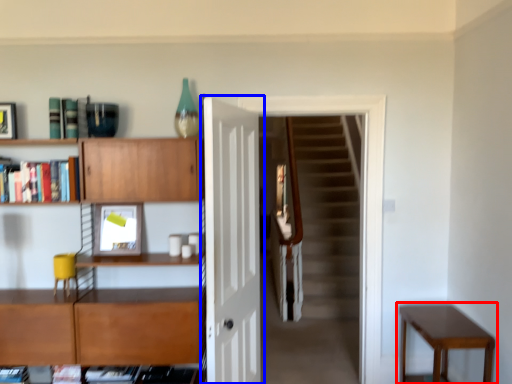
Question: Among these objects, which one is farthest to the camera, table (highlighted by a red box) or door (highlighted by a blue box)?

Choices:
 (A) table
 (B) door

Answer: (A)